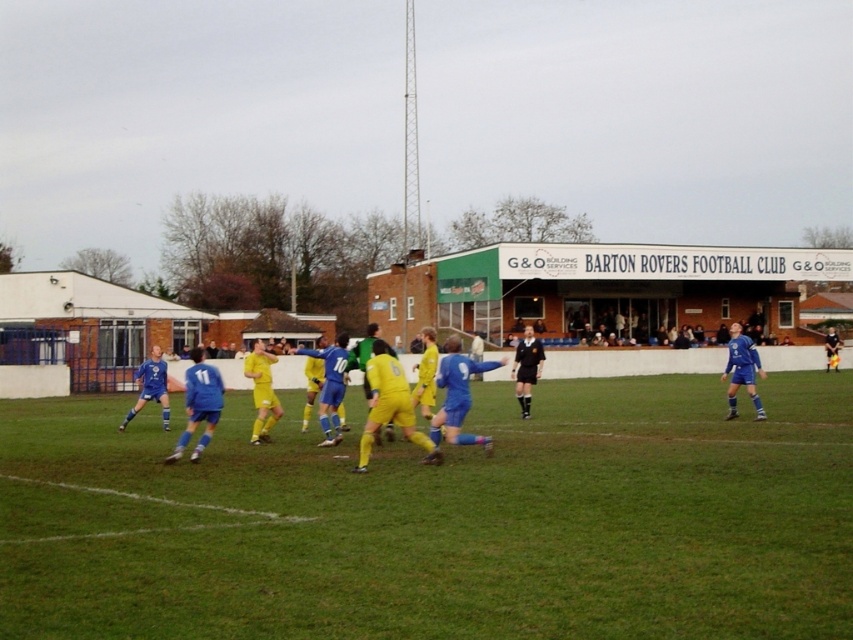
Question: Which point is closer to the camera?

Choices:
 (A) (519, 380)
 (B) (473, 368)
 (C) (310, 500)

Answer: (C)

Question: Does green grass field at center have a greater width compared to yellow matte soccer players at center?

Choices:
 (A) yes
 (B) no

Answer: (A)

Question: Considering the real-world distances, which object is closest to the yellow matte soccer players at center?

Choices:
 (A) green grass field at center
 (B) black smooth shirt at center

Answer: (A)

Question: Which object appears farthest from the camera in this image?

Choices:
 (A) yellow matte soccer players at center
 (B) green grass field at center
 (C) black smooth shirt at center

Answer: (C)

Question: Is green grass field at center smaller than black smooth shirt at center?

Choices:
 (A) no
 (B) yes

Answer: (A)

Question: Is green grass field at center above black smooth shirt at center?

Choices:
 (A) no
 (B) yes

Answer: (A)